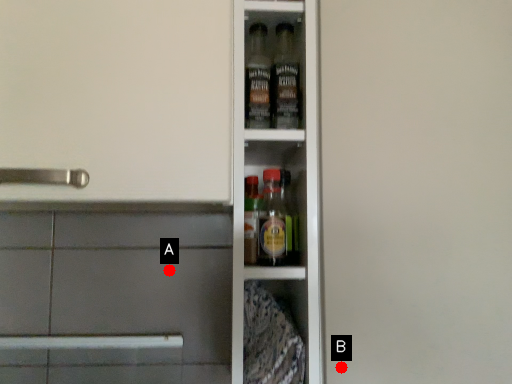
Question: Two points are circled on the image, labeled by A and B beside each circle. Which point is farther from the camera taking this photo?

Choices:
 (A) A is further
 (B) B is further

Answer: (A)